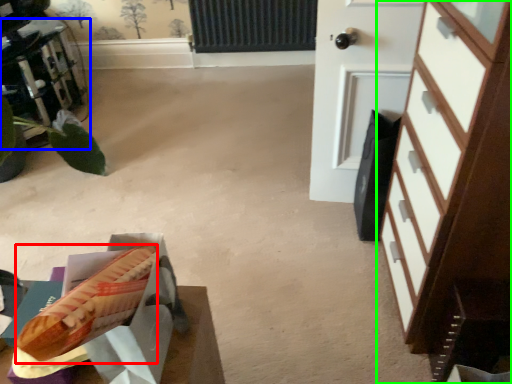
Question: Which object is positioned closest to hot dog (highlighted by a red box)? Select from furniture (highlighted by a blue box) and chest of drawers (highlighted by a green box).

Choices:
 (A) furniture
 (B) chest of drawers

Answer: (B)